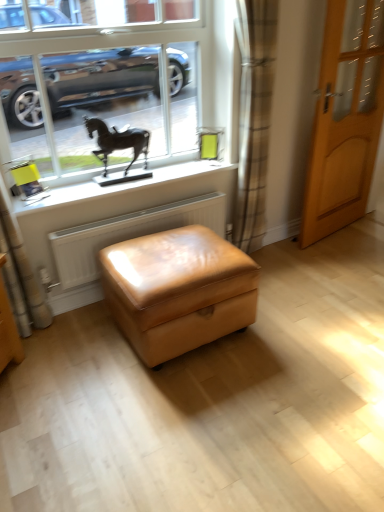
I want to click on free location in front of plaid fabric curtain at center, so click(x=273, y=276).